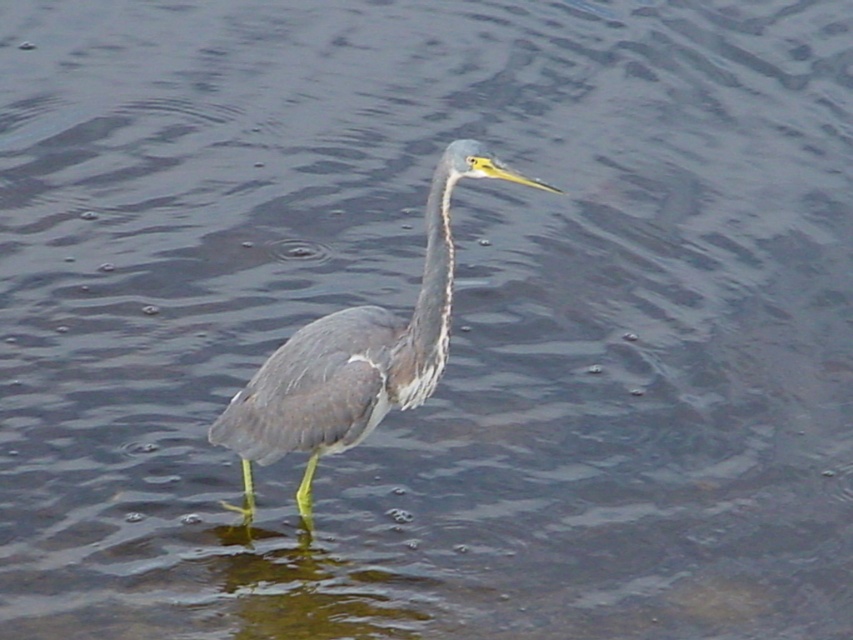
Which of these two, gray matte heron at center or gray matte neck at center, stands taller?

gray matte heron at center is taller.

Based on the photo, between gray matte heron at center and gray matte neck at center, which one is positioned higher?

gray matte neck at center is higher up.

Which is in front, point (268, 420) or point (433, 298)?

Positioned in front is point (433, 298).

Locate an element on the screen. The width and height of the screenshot is (853, 640). gray matte heron at center is located at coordinates (355, 355).